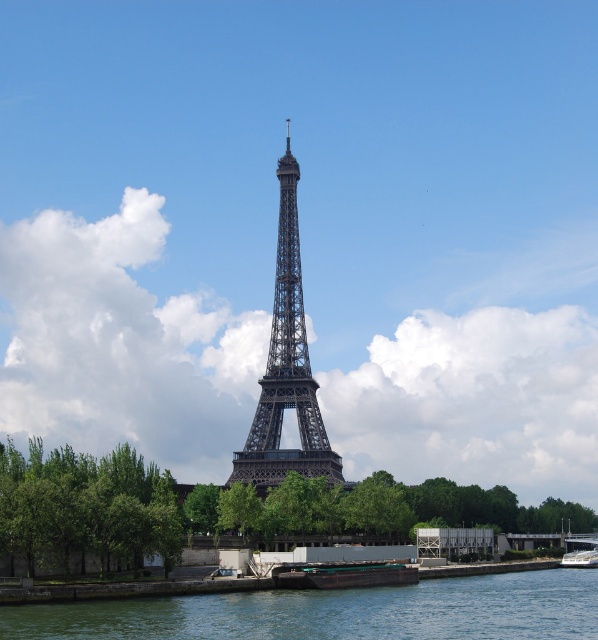
Question: Estimate the real-world distances between objects in this image. Which object is closer to the dark gray metal eiffel tower at center?

Choices:
 (A) green water at lower center
 (B) metallic polished boat at lower right
 (C) green matte barge at lower center

Answer: (C)

Question: Does green water at lower center appear under dark gray metal eiffel tower at center?

Choices:
 (A) no
 (B) yes

Answer: (B)

Question: Which of the following is the farthest from the observer?

Choices:
 (A) (341, 576)
 (B) (90, 609)
 (C) (316, 387)
 (D) (575, 564)

Answer: (C)

Question: Observing the image, what is the correct spatial positioning of green water at lower center in reference to green matte barge at lower center?

Choices:
 (A) above
 (B) below

Answer: (B)

Question: Observing the image, what is the correct spatial positioning of dark gray metal eiffel tower at center in reference to green matte barge at lower center?

Choices:
 (A) right
 (B) left

Answer: (B)

Question: Estimate the real-world distances between objects in this image. Which object is farther from the dark gray metal eiffel tower at center?

Choices:
 (A) green leafy tree at lower left
 (B) metallic polished boat at lower right

Answer: (B)